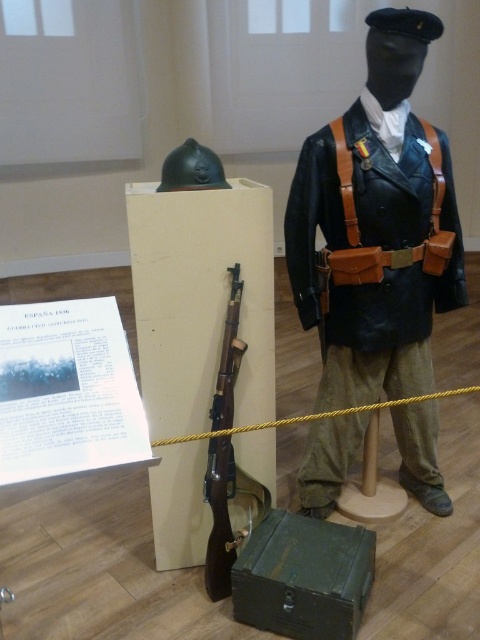
Question: Is leather jacket at center to the right of wooden rifle at center from the viewer's perspective?

Choices:
 (A) no
 (B) yes

Answer: (B)

Question: Is leather jacket at center behind wooden rifle at center?

Choices:
 (A) no
 (B) yes

Answer: (A)

Question: Among these objects, which one is farthest from the camera?

Choices:
 (A) leather jacket at center
 (B) wooden rifle at center

Answer: (B)

Question: In this image, where is leather jacket at center located relative to wooden rifle at center?

Choices:
 (A) below
 (B) above

Answer: (B)

Question: Which object appears farthest from the camera in this image?

Choices:
 (A) leather jacket at center
 (B) wooden rifle at center

Answer: (B)

Question: Which of the following is the farthest from the observer?

Choices:
 (A) (425, 467)
 (B) (218, 424)

Answer: (A)